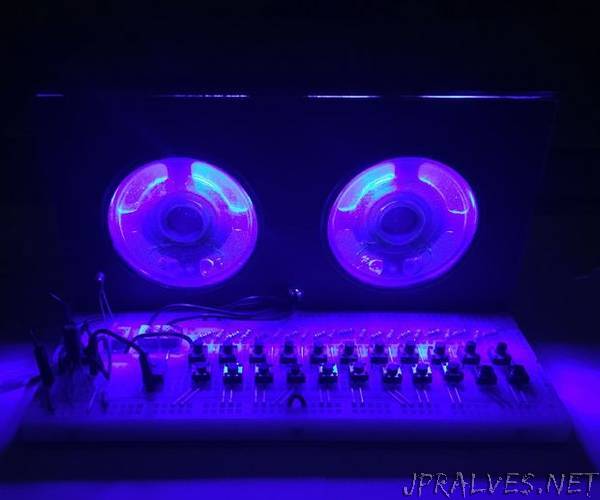
In order to click on table in this screenshot , I will do `click(575, 380)`.